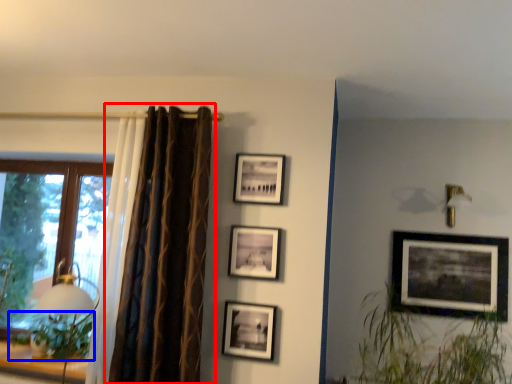
Question: Which point is closer to the camera, curtain (highlighted by a red box) or plant (highlighted by a blue box)?

Choices:
 (A) curtain
 (B) plant

Answer: (A)